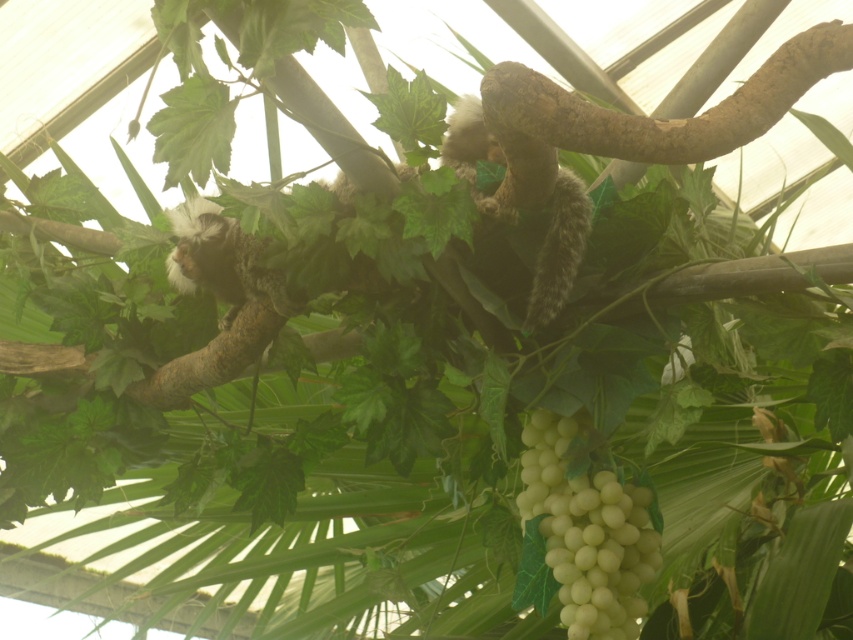
Does point (718, 124) lie behind point (582, 579)?

No, (718, 124) is closer to viewer.

Does brown rough tree branch at upper right have a lesser width compared to white matte grapes at lower right?

No.

The image size is (853, 640). I want to click on brown rough tree branch at upper right, so click(x=670, y=120).